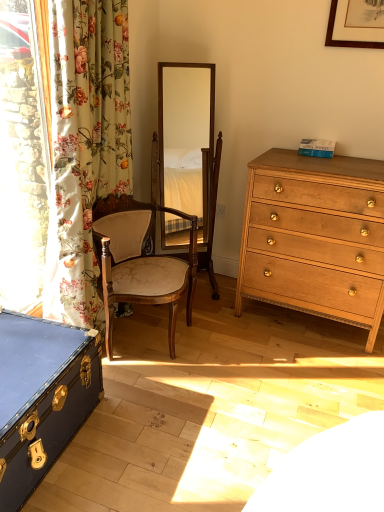
Question: Is wooden upholstered chair at center in front of or behind light brown wooden chest of drawers at right in the image?

Choices:
 (A) behind
 (B) front

Answer: (B)

Question: Is wooden upholstered chair at center bigger or smaller than light brown wooden chest of drawers at right?

Choices:
 (A) small
 (B) big

Answer: (A)

Question: Estimate the real-world distances between objects in this image. Which object is closer to the floral fabric curtain at left?

Choices:
 (A) light brown wooden chest of drawers at right
 (B) white plastic power outlet at center
 (C) blue leather trunk at lower left
 (D) wooden upholstered chair at center
 (E) wooden swivel chair at center

Answer: (D)

Question: Estimate the real-world distances between objects in this image. Which object is closer to the floral fabric curtain at left?

Choices:
 (A) white plastic power outlet at center
 (B) wooden swivel chair at center
 (C) light brown wooden chest of drawers at right
 (D) wooden upholstered chair at center
 (E) blue leather trunk at lower left

Answer: (D)